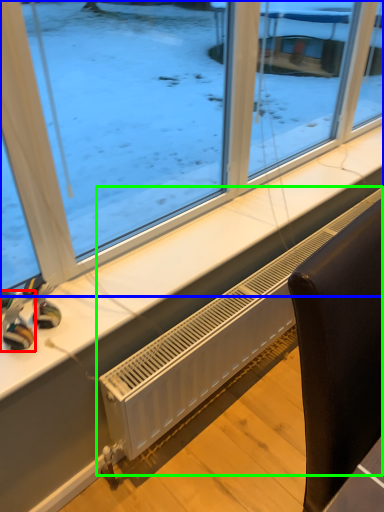
Question: Based on their relative distances, which object is farther from toy (highlighted by a red box)? Choose from window (highlighted by a blue box) and air conditioning (highlighted by a green box).

Choices:
 (A) window
 (B) air conditioning

Answer: (A)